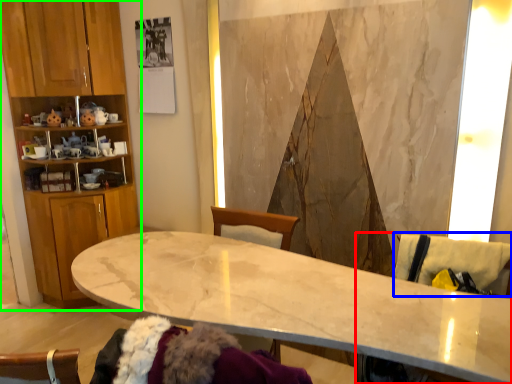
Question: Considering the real-world distances, which object is farthest from swivel chair (highlighted by a red box)? swivel chair (highlighted by a blue box) or cabinetry (highlighted by a green box)?

Choices:
 (A) swivel chair
 (B) cabinetry

Answer: (B)